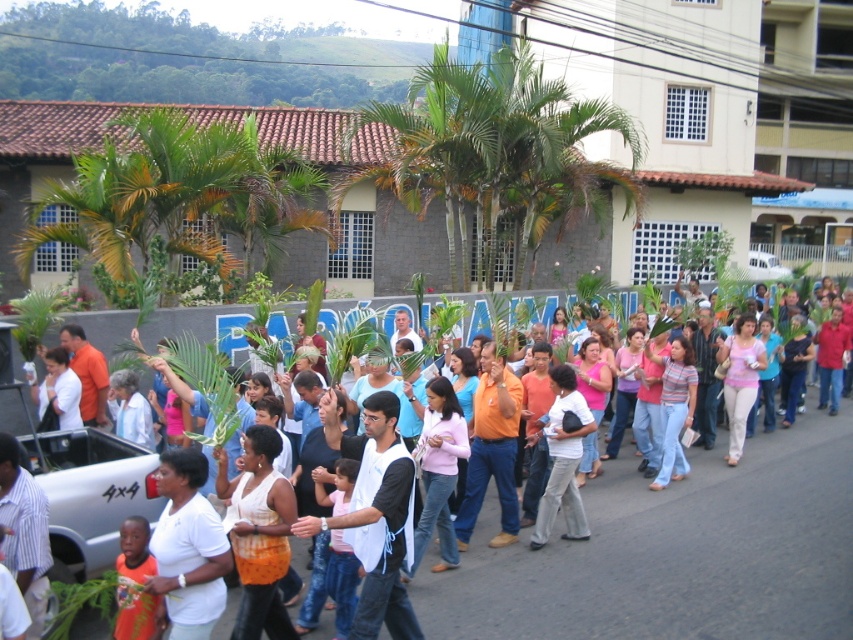
From the picture: Can you confirm if orange cotton shirt at center is positioned to the left of striped cotton shirt at center?

Yes, orange cotton shirt at center is to the left of striped cotton shirt at center.

Who is more forward, (515, 536) or (677, 388)?

Point (515, 536) is more forward.

I want to click on orange cotton shirt at center, so click(x=492, y=451).

Is white cotton shirt at center wider than striped cotton shirt at center?

Yes.

Between white cotton shirt at center and striped cotton shirt at center, which one appears on the left side from the viewer's perspective?

From the viewer's perspective, white cotton shirt at center appears more on the left side.

Image resolution: width=853 pixels, height=640 pixels. Identify the location of white cotton shirt at center. (561, 460).

Looking at this image, does white matte shirt at center have a larger size compared to striped cotton shirt at center?

No, white matte shirt at center is not bigger than striped cotton shirt at center.

Does white matte shirt at center have a lesser height compared to striped cotton shirt at center?

Correct, white matte shirt at center is not as tall as striped cotton shirt at center.

What do you see at coordinates (189, 547) in the screenshot? This screenshot has width=853, height=640. I see `white matte shirt at center` at bounding box center [189, 547].

Where is `white matte shirt at center`? Image resolution: width=853 pixels, height=640 pixels. white matte shirt at center is located at coordinates (189, 547).